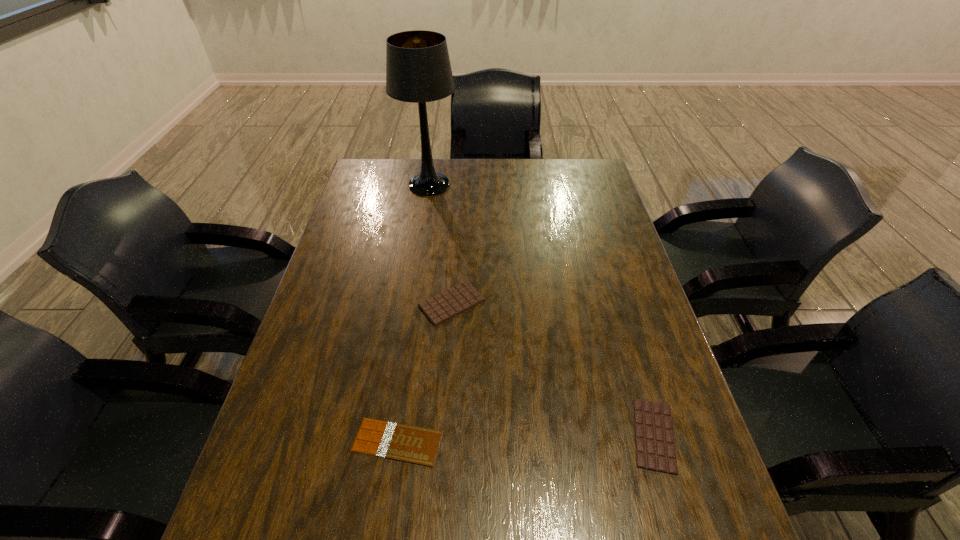
Find the location of a particular element. This screenshot has width=960, height=540. vacant space that's between the farthest object and the rightmost object is located at coordinates (541, 310).

The width and height of the screenshot is (960, 540). Identify the location of empty space that is in between the table lamp and the shortest chocolate bar. (414, 313).

You are a GUI agent. You are given a task and a screenshot of the screen. Output one action in this format:
    pyautogui.click(x=<x>, y=<y>)
    Task: Click on the vacant space in between the tallest object and the shortest object
    This screenshot has height=540, width=960.
    Given the screenshot: What is the action you would take?
    pyautogui.click(x=414, y=313)

Image resolution: width=960 pixels, height=540 pixels. In order to click on free spot between the shortest object and the second shortest chocolate bar in this screenshot , I will do `click(526, 438)`.

This screenshot has height=540, width=960. I want to click on free space between the rightmost object and the shortest object, so click(x=526, y=438).

Find the location of a particular element. free point between the farthest chocolate bar and the rightmost object is located at coordinates (553, 369).

Identify the location of unoccupied area between the tallest chocolate bar and the table lamp. The image size is (960, 540). point(441,244).

Where is `vacant space in between the shortest chocolate bar and the tallest chocolate bar`? The image size is (960, 540). vacant space in between the shortest chocolate bar and the tallest chocolate bar is located at coordinates (424, 373).

Identify the location of vacant area between the farthest chocolate bar and the second tallest chocolate bar. Image resolution: width=960 pixels, height=540 pixels. 553,369.

At what (x,y) coordinates should I click in order to perform the action: click on the closest object to the rightmost chocolate bar. Please return your answer as a coordinate pair (x, y). This screenshot has width=960, height=540. Looking at the image, I should click on (452, 302).